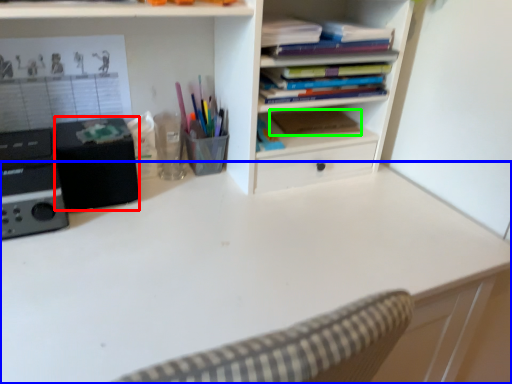
Question: Which object is positioned closest to speaker (highlighted by a red box)? Select from desk (highlighted by a blue box) and paperback book (highlighted by a green box).

Choices:
 (A) desk
 (B) paperback book

Answer: (A)